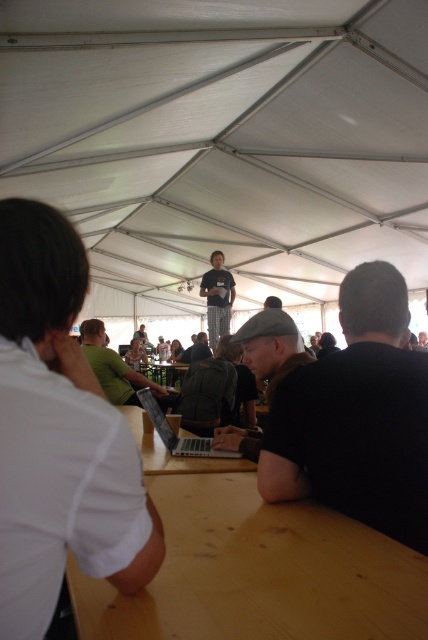
You are a photographer standing at the back of the tent. You want to take a photo of both the green fabric shirt at center and the dark gray shirt at center in the same frame. Given that your camera has a maximum focus range of 2 meters, will both shirts be in focus?

The green fabric shirt at center and dark gray shirt at center are 2.03 meters apart. Since the distance between them exceeds the camera focus range of 2 meters, both shirts may not be in focus simultaneously.

You are a photographer at the event and want to capture both the green fabric shirt at center and the dark gray shirt at center in a single shot. Based on their positions, which shirt should you focus on first to ensure both are in the frame?

The green fabric shirt at center is located below dark gray shirt at center, so focusing on the dark gray shirt at center first will help ensure both are within the frame since it is positioned higher up.

You are organizing a photo shoot under the white fabric canopy at upper center and need to ensure the green fabric shirt at center is visible. Given their sizes, will the canopy overshadow the shirt in the photo?

The white fabric canopy at upper center is larger than the green fabric shirt at center, so it may overshadow the shirt in the photo.